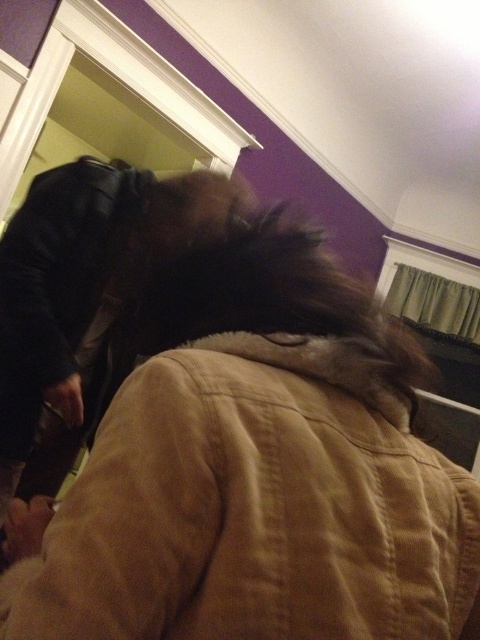
You are standing in a room with purple walls and white trim. You see a point at coordinates [254,470]. What object is located at that point?

The point at coordinates [254,470] corresponds to the brown fur coat at upper center.